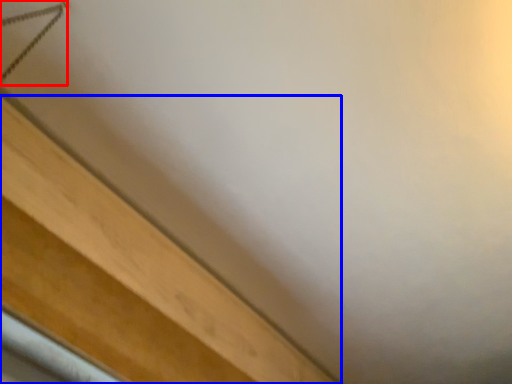
Question: Which of the following is the closest to the observer, twin (highlighted by a red box) or furniture (highlighted by a blue box)?

Choices:
 (A) twin
 (B) furniture

Answer: (A)